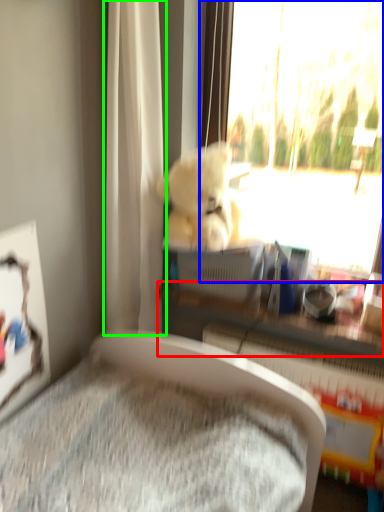
Question: Which object is positioned closest to shelf (highlighted by a red box)? Select from window (highlighted by a blue box) and curtain (highlighted by a green box).

Choices:
 (A) window
 (B) curtain

Answer: (B)